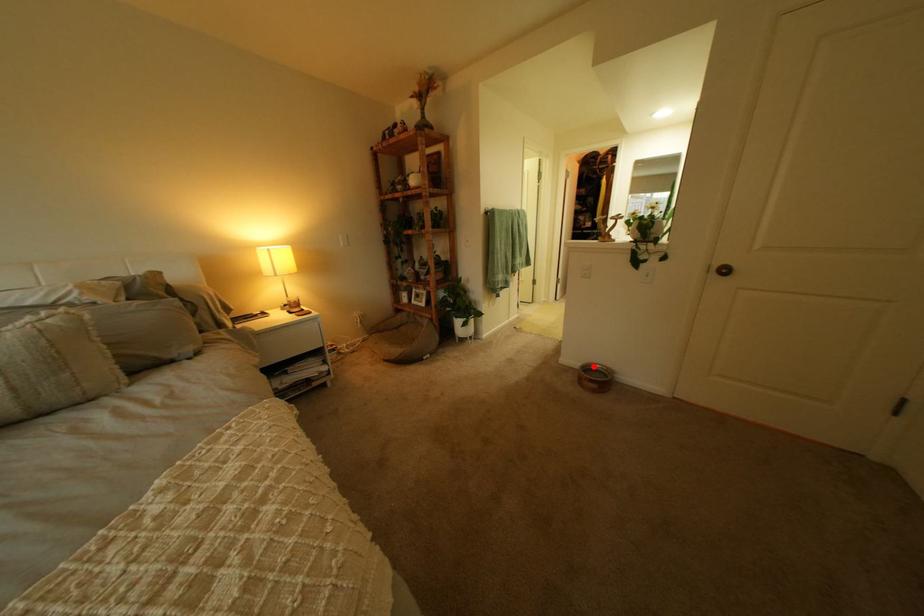
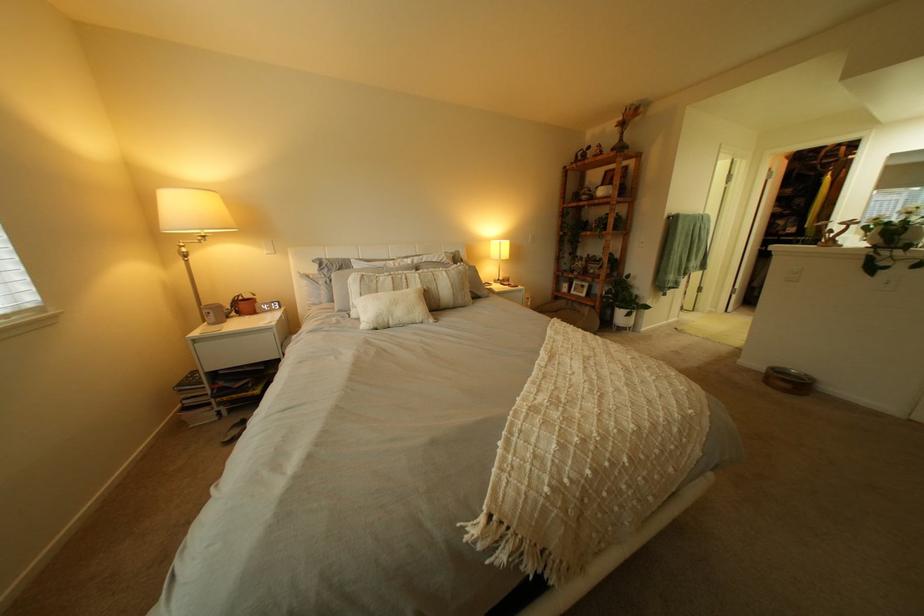
Question: I am providing you with two images of the same scene from different viewpoints. In image1, a red point is highlighted. Considering the same 3D point in image2, which of the following is correct?

Choices:
 (A) It is closer
 (B) It is farther

Answer: (B)